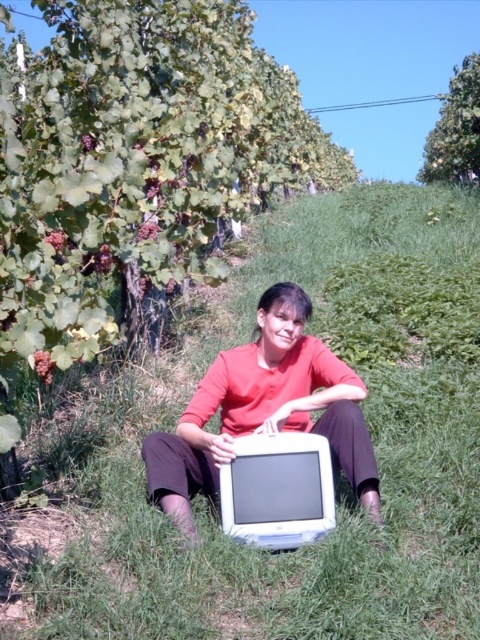
You are standing on the grassy hillside in the vineyard and want to place a small potted plant between the green grassy at center and the matte white monitor at center. Which object should the potted plant be closer to?

The potted plant should be placed closer to the matte white monitor at center because the green grassy at center is already in front of the matte white monitor at center, so placing the potted plant between them would require it to be near the monitor to maintain spatial order.

You are standing in a vineyard and see the green grassy at center. If you want to place a small picnic basket on the grass, where should you place it?

You should place the small picnic basket on the green grassy at center located at point (340, 483).

You are a photographer wanting to capture a photo of the green grassy at center and the matte white monitor at center. If your camera can only focus on objects within a 1.2 meters distance from the focal point, where should you set the focal point to ensure both objects are in focus?

Set the focal point between the green grassy at center and the matte white monitor at center since they are 1.24 meters apart. This way, both objects will be within the camera focus range of 1.2 meters.